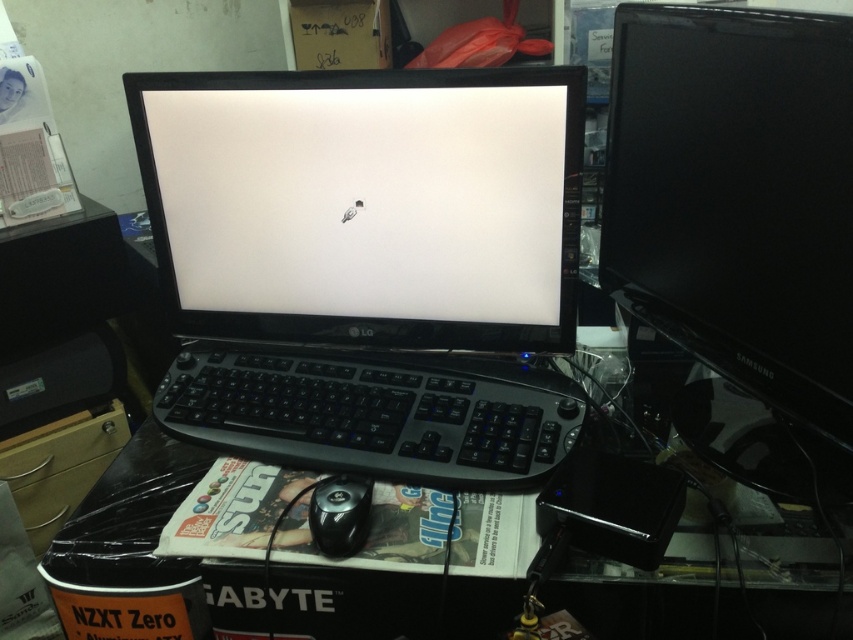
You are setting up a new desk arrangement and need to place a 12cm tall plant pot exactly at the center of the desk. The desk has a black plastic monitor at center. Where should you place the plant pot?

The black plastic monitor at center is located at point (367,262), so the plant pot should be placed at the same coordinates to ensure it is at the desk center.

Looking at this image, you are setting up a new desk and need to place a wireless charger exactly at the center of the desk. The desk has a coordinate system where the bottom left corner is the origin point. The wireless charger must be placed at the point that is exactly halfway between the black plastic monitor at center and the edge of the desk. What are the coordinates of the wireless charger?

The coordinates of the wireless charger would be halfway between the black plastic monitor at center at point (367,262) and the edge of the desk. Since the edge of the desk is at 1.0 in the coordinate system, the midpoint between 0.412 and 1.0 is 0.706, and between 0.431 and 1.0 is 0.7155. Therefore, the wireless charger should be placed at approximately (610,451).